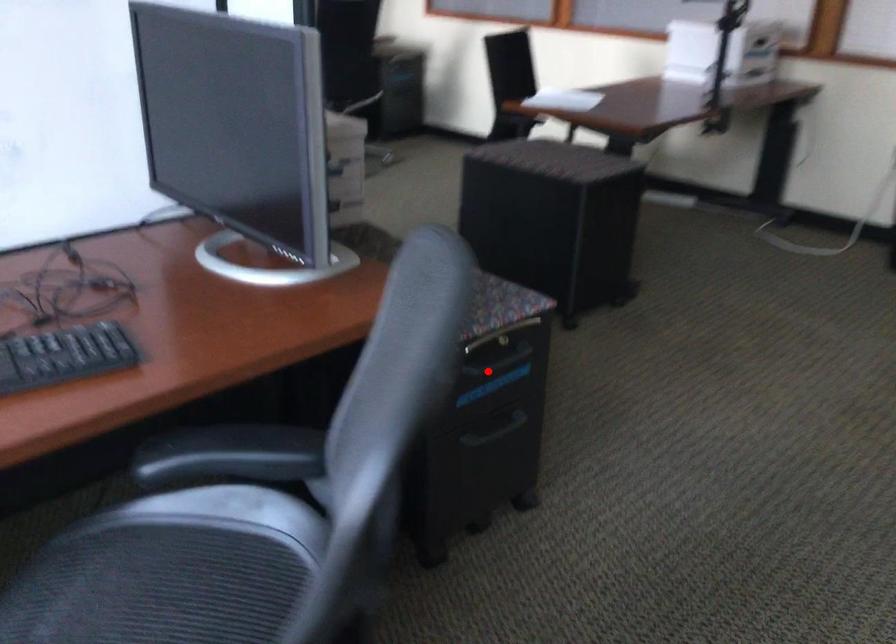
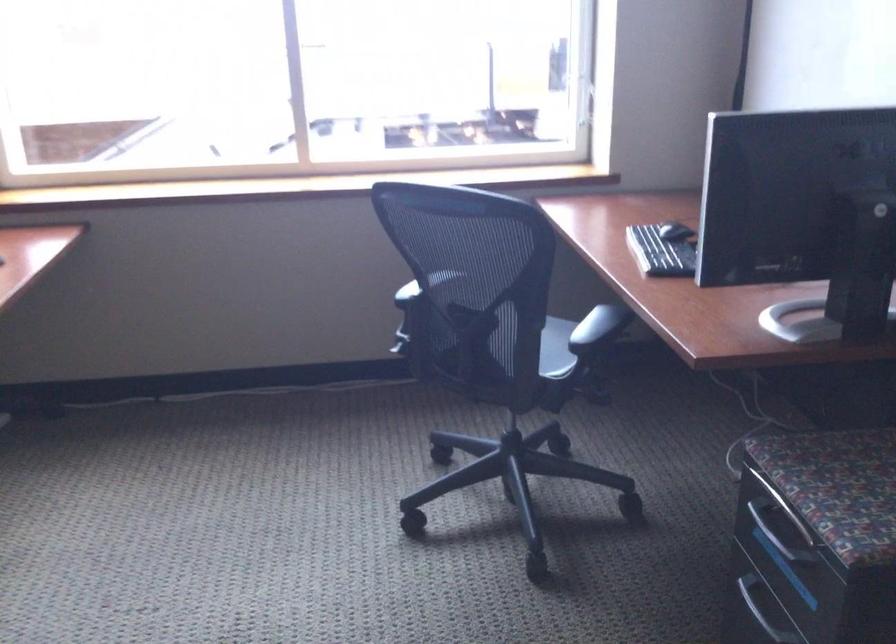
Locate, in the second image, the point that corresponds to the highlighted location in the first image.

(776, 532)